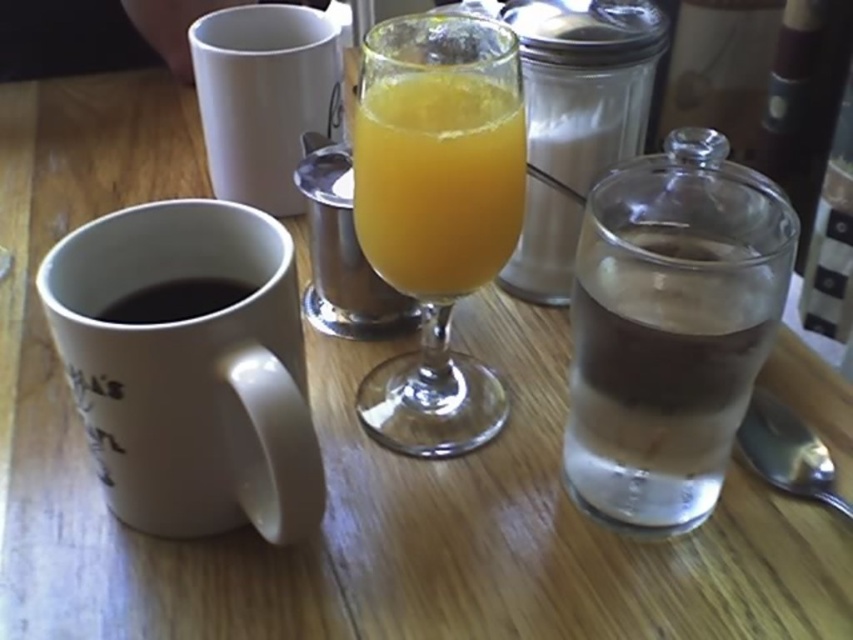
You have a small toy car that is 2 inches long. You want to place it between the white matte mug at left and the black matte mug at left on the table. Will it fit without overlapping either mug?

The distance between the white matte mug at left and the black matte mug at left is 1.99 inches. Since the toy car is 2 inches long, it will not fit between them without overlapping the mugs.

You are trying to place a 10 inch ruler between the two objects at point (287, 150). Will the ruler fit between them?

The two objects at point (287, 150) are 20.60 inches apart, so yes, the 10 inch ruler will fit between them since it is shorter than the distance between the objects.

You are setting up a breakfast table and have two mugs, the white matte mug at left and the black matte mug at left. Which one is taller?

The white matte mug at left is taller than the black matte mug at left.